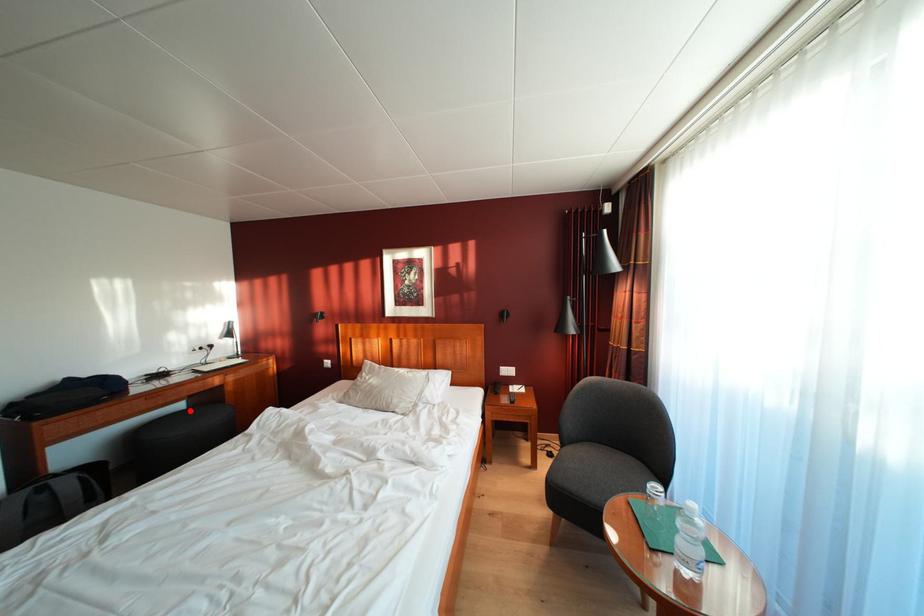
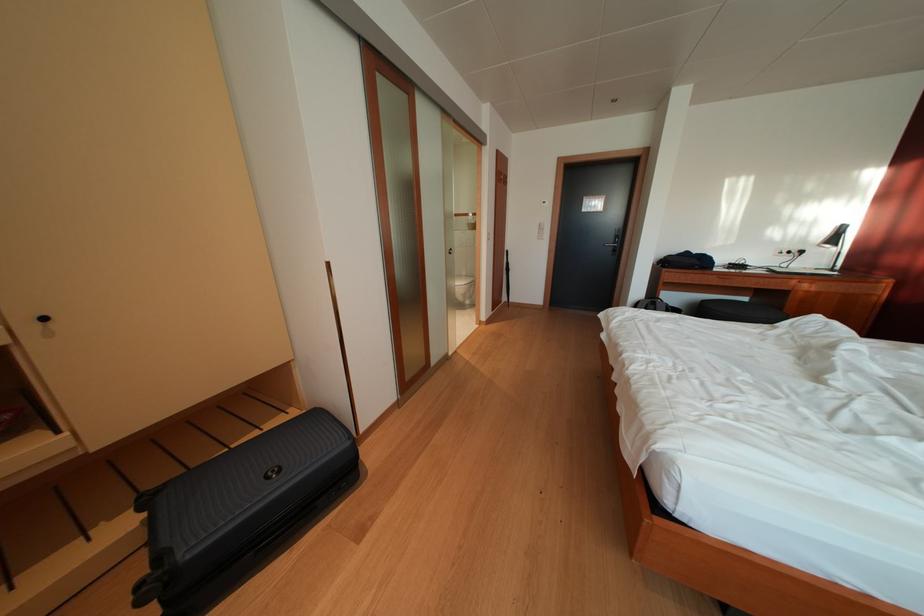
The point at the highlighted location is marked in the first image. Where is the corresponding point in the second image?

(752, 305)